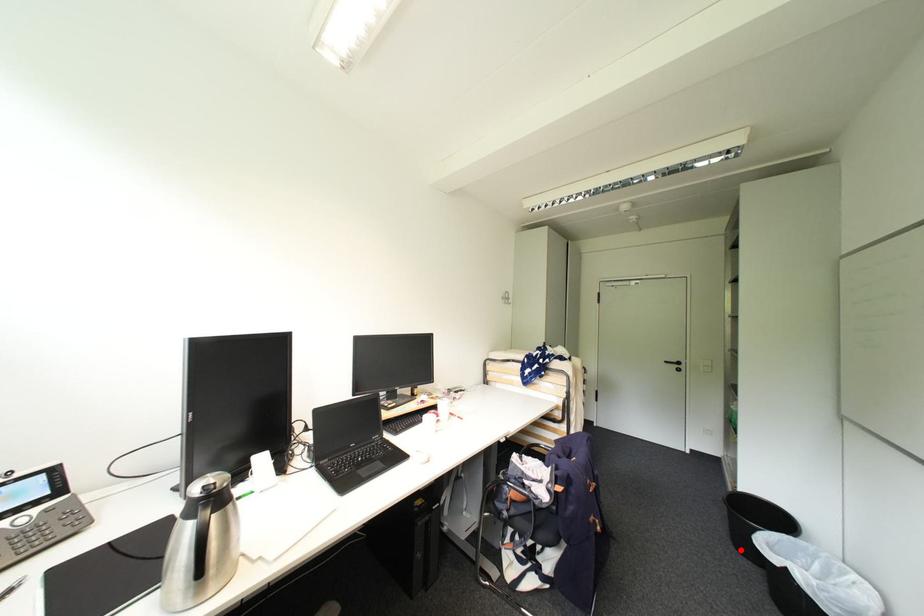
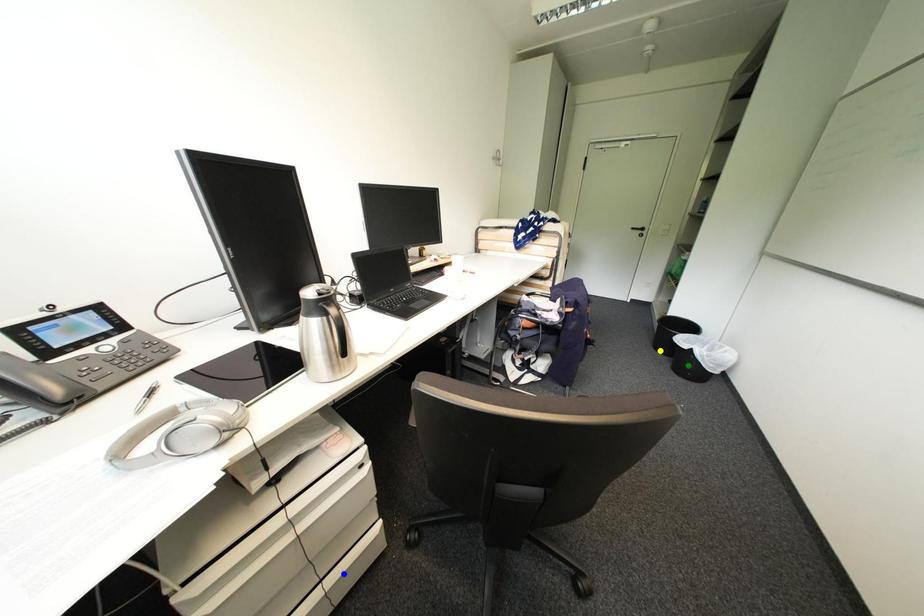
Question: I am providing you with two images of the same scene from different viewpoints. A red point is marked on the first image. You are given multiple points on the second image. Which point in image 2 is actually the same real-world point as the red point in image 1?

Choices:
 (A) green point
 (B) yellow point
 (C) blue point

Answer: (B)